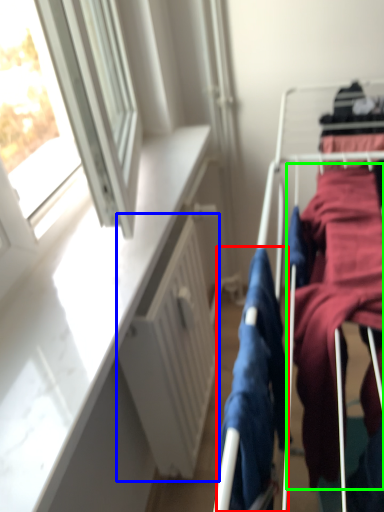
Question: Which object is the farthest from clothing (highlighted by a red box)? Choose among these: radiator (highlighted by a blue box) or clothing (highlighted by a green box).

Choices:
 (A) radiator
 (B) clothing

Answer: (A)